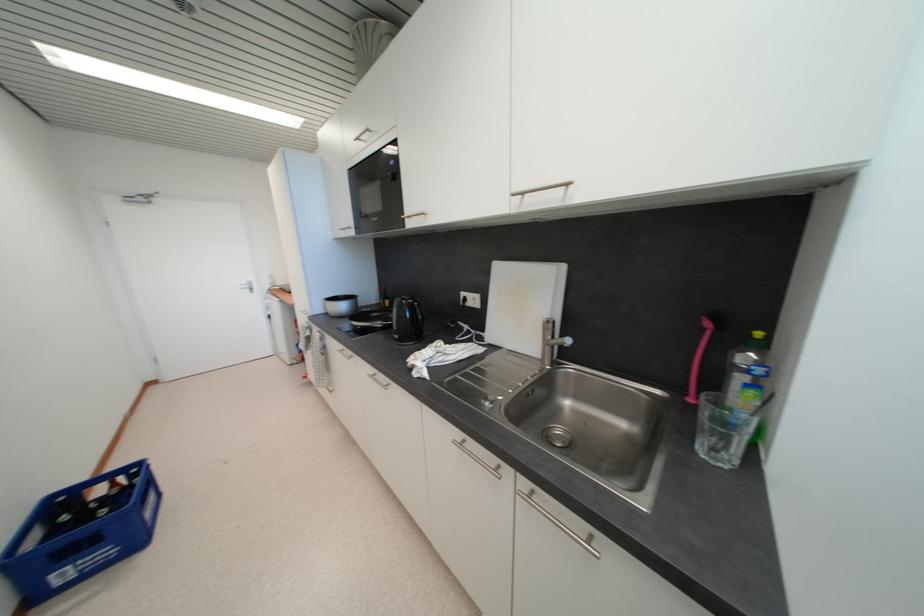
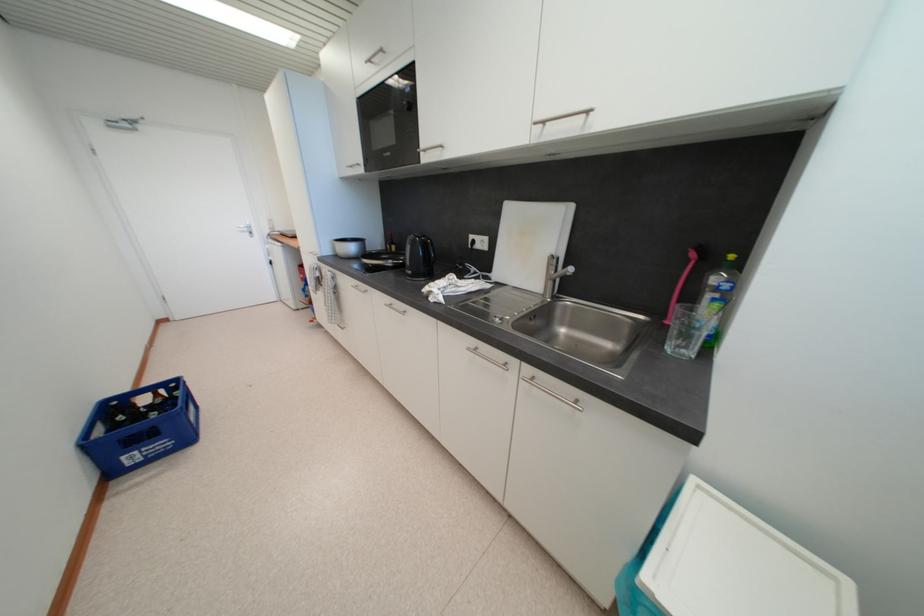
Find the pixel in the second image that matches (757,394) in the first image.

(723, 307)